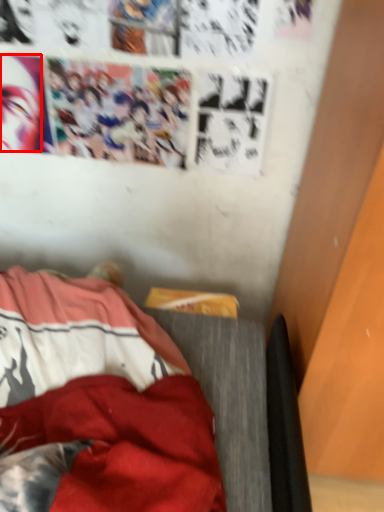
Question: Considering the relative positions of human face (annotated by the red box) and furniture in the image provided, where is human face (annotated by the red box) located with respect to the staircase?

Choices:
 (A) left
 (B) right

Answer: (A)